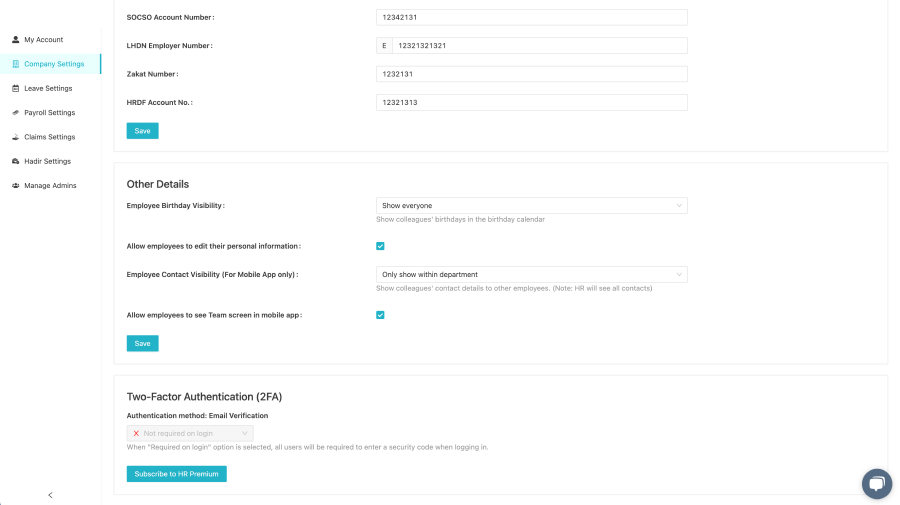
Where is `box`? The width and height of the screenshot is (900, 505). box is located at coordinates (597, 195).